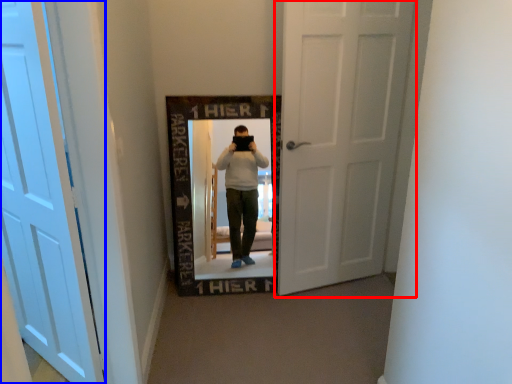
Question: Which object appears farthest to the camera in this image, door (highlighted by a red box) or door (highlighted by a blue box)?

Choices:
 (A) door
 (B) door

Answer: (A)